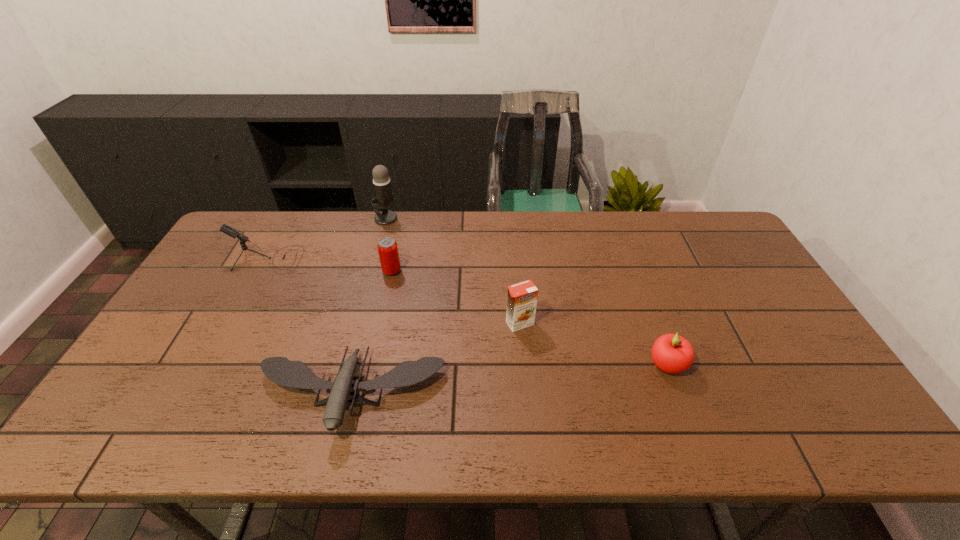
The image size is (960, 540). I want to click on object that can be found as the second closest to the right microphone, so [232, 232].

Locate which object ranks second in proximity to the nearer microphone. Please provide its 2D coordinates. Your answer should be formatted as a tuple, i.e. [(x, y)], where the tuple contains the x and y coordinates of a point satisfying the conditions above.

[(387, 247)]

Identify the location of vacant region that satisfies the following two spatial constraints: 1. on the stand of the apple; 2. on the left side of the leftmost object. (211, 364).

Locate an element on the screen. This screenshot has height=540, width=960. free location that satisfies the following two spatial constraints: 1. on the front side of the taller microphone; 2. on the right side of the rightmost object is located at coordinates (347, 364).

In order to click on blank space that satisfies the following two spatial constraints: 1. on the front side of the apple; 2. on the left side of the orange juice in this screenshot , I will do `click(523, 364)`.

Where is `free space that satisfies the following two spatial constraints: 1. on the back side of the rightmost object; 2. on the stand of the leftmost object`? This screenshot has height=540, width=960. free space that satisfies the following two spatial constraints: 1. on the back side of the rightmost object; 2. on the stand of the leftmost object is located at coordinates (628, 259).

Image resolution: width=960 pixels, height=540 pixels. I want to click on vacant area in the image that satisfies the following two spatial constraints: 1. on the back side of the can; 2. on the stand of the leftmost object, so click(x=395, y=259).